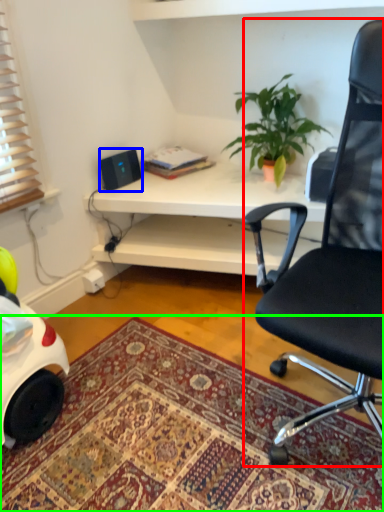
Question: Considering the real-world distances, which object is farthest from chair (highlighted by a red box)? speaker (highlighted by a blue box) or mat (highlighted by a green box)?

Choices:
 (A) speaker
 (B) mat

Answer: (A)